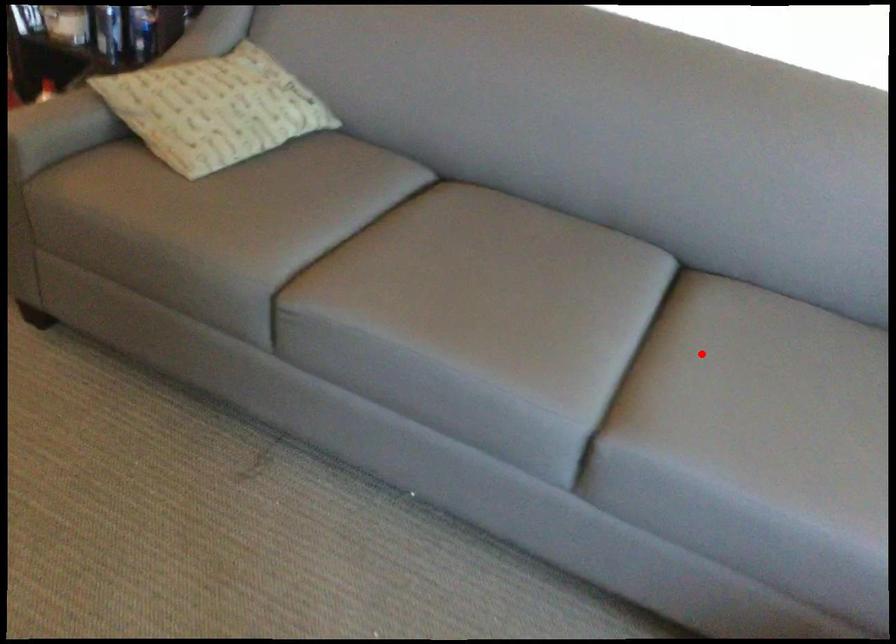
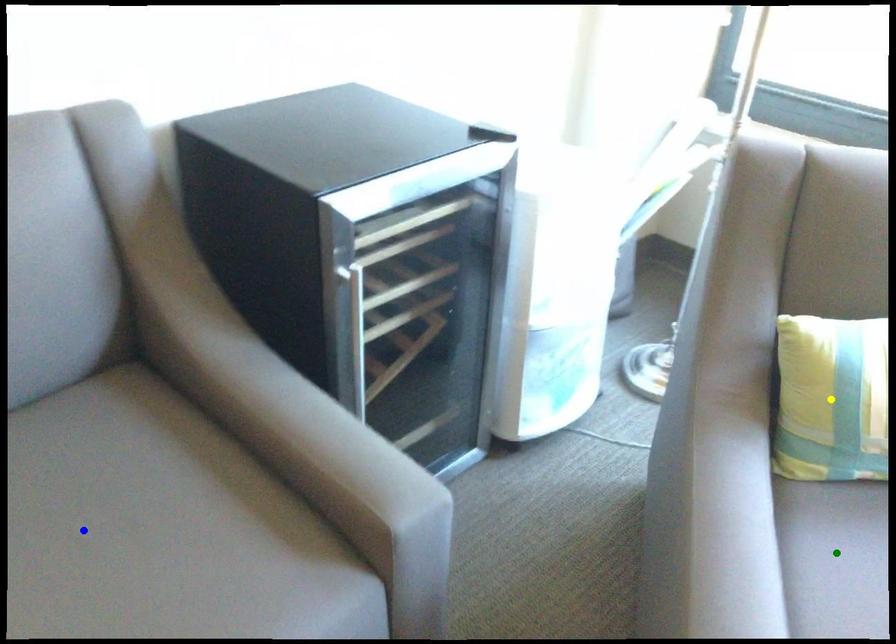
Question: I am providing you with two images of the same scene from different viewpoints. A red point is marked on the first image. You are given multiple points on the second image. Which spot in image 2 lines up with the point in image 1?

Choices:
 (A) green point
 (B) yellow point
 (C) blue point

Answer: (C)